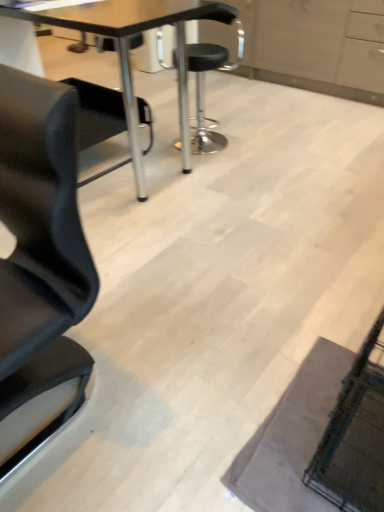
Question: Choose the correct answer: Is black leather stool at center inside matte black table at center or outside it?

Choices:
 (A) inside
 (B) outside

Answer: (B)

Question: Relative to matte black table at center, is black leather stool at center in front or behind?

Choices:
 (A) behind
 (B) front

Answer: (A)

Question: Based on their positions, is black leather stool at center located to the left or right of matte black table at center?

Choices:
 (A) left
 (B) right

Answer: (B)

Question: From a real-world perspective, relative to black leather stool at center, is matte black table at center vertically above or below?

Choices:
 (A) below
 (B) above

Answer: (B)

Question: Considering the positions of point (134, 23) and point (195, 115), is point (134, 23) closer or farther from the camera than point (195, 115)?

Choices:
 (A) closer
 (B) farther

Answer: (A)

Question: Is matte black table at center inside or outside of black leather stool at center?

Choices:
 (A) inside
 (B) outside

Answer: (B)

Question: In terms of width, does matte black table at center look wider or thinner when compared to black leather stool at center?

Choices:
 (A) wide
 (B) thin

Answer: (A)